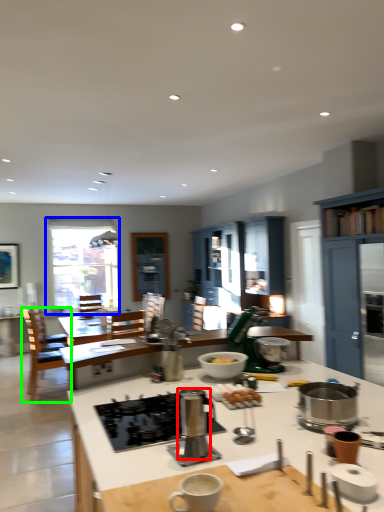
Question: Considering the real-world distances, which object is farthest from appliance (highlighted by a red box)? window (highlighted by a blue box) or chair (highlighted by a green box)?

Choices:
 (A) window
 (B) chair

Answer: (A)